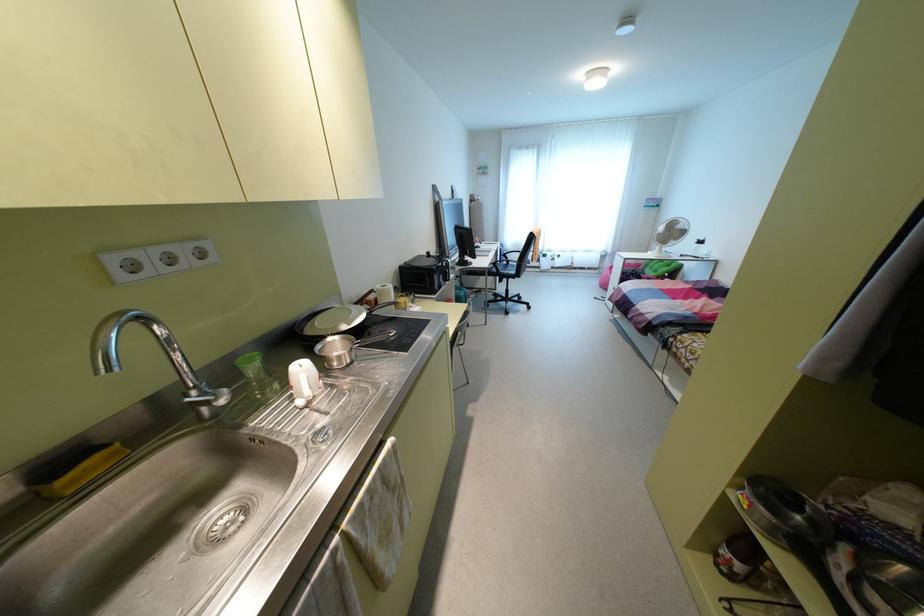
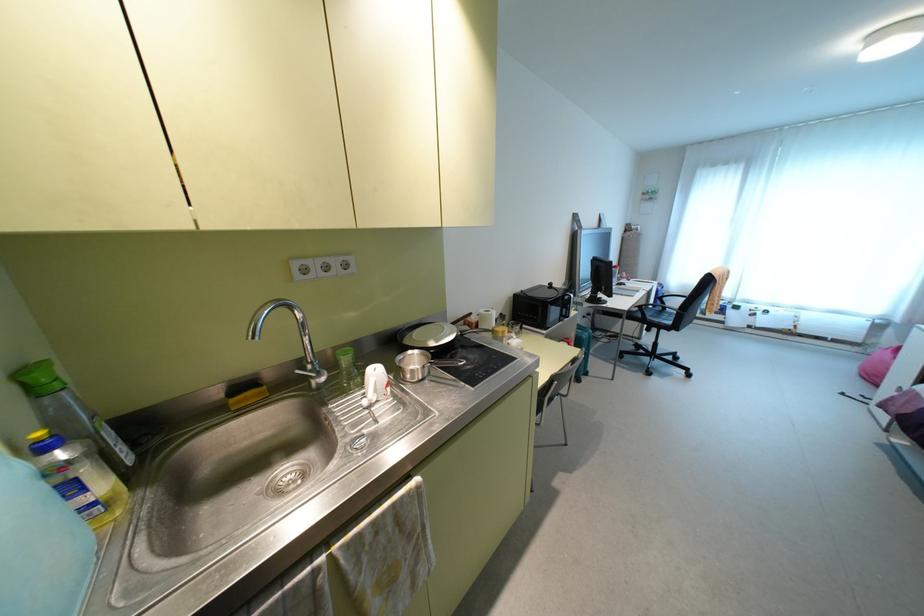
The point at (x=514, y=256) is marked in the first image. Where is the corresponding point in the second image?

(674, 302)